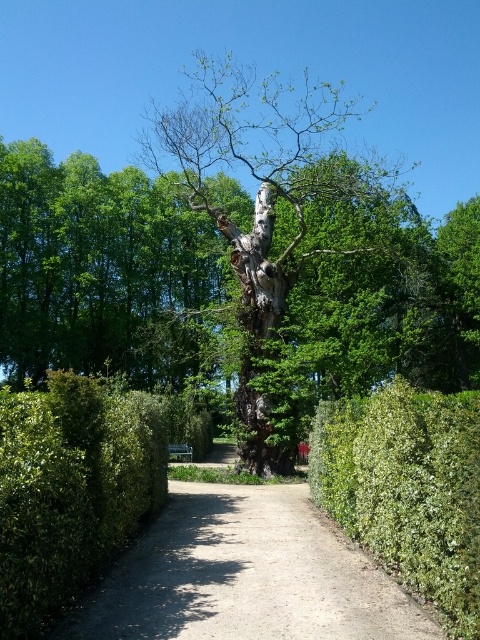
Does green leafy hedge at center come behind green leafy hedge at right?

No.

From the picture: Which is below, green leafy hedge at center or green leafy hedge at right?

green leafy hedge at right is below.

Is point (108, 410) farther from viewer compared to point (314, 419)?

No.

The height and width of the screenshot is (640, 480). Identify the location of green leafy hedge at center. (71, 490).

Between dirt/gravel path at center and green leafy hedge at right, which one is positioned higher?

green leafy hedge at right

Is dirt/gravel path at center behind green leafy hedge at right?

Yes, dirt/gravel path at center is behind green leafy hedge at right.

At what (x,y) coordinates should I click in order to perform the action: click on dirt/gravel path at center. Please return your answer as a coordinate pair (x, y). The image size is (480, 640). Looking at the image, I should click on (244, 576).

The image size is (480, 640). In order to click on dirt/gravel path at center in this screenshot , I will do `click(244, 576)`.

Can you confirm if dirt/gravel path at center is positioned above dark brown bark tree at center?

Actually, dirt/gravel path at center is below dark brown bark tree at center.

Is dirt/gravel path at center below dark brown bark tree at center?

Indeed, dirt/gravel path at center is positioned under dark brown bark tree at center.

Between point (309, 589) and point (287, 102), which one is positioned behind?

Positioned behind is point (287, 102).

This screenshot has width=480, height=640. Identify the location of dirt/gravel path at center. (244, 576).